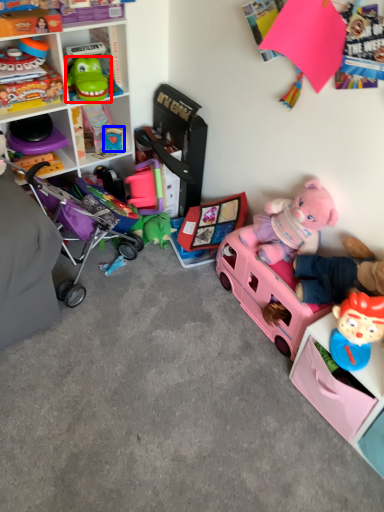
Question: Which object appears farthest to the camera in this image, toy (highlighted by a red box) or toy (highlighted by a blue box)?

Choices:
 (A) toy
 (B) toy

Answer: (B)